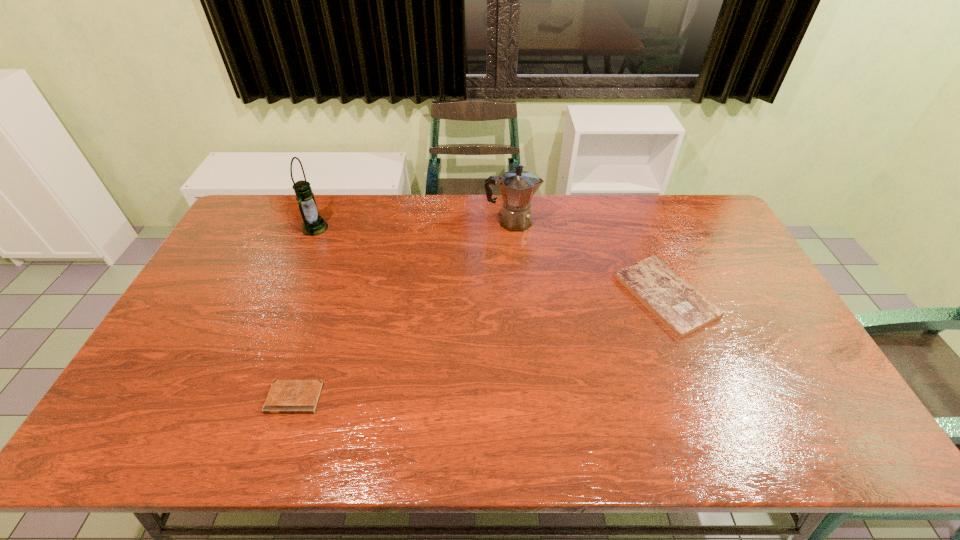
Select which object appears as the third closest to the third object from right to left. Please provide its 2D coordinates. Your answer should be formatted as a tuple, i.e. [(x, y)], where the tuple contains the x and y coordinates of a point satisfying the conditions above.

[(679, 306)]

Find the location of `free space that satisfies the following two spatial constraints: 1. on the pouring side of the coffeepot; 2. on the back side of the rightmost object`. free space that satisfies the following two spatial constraints: 1. on the pouring side of the coffeepot; 2. on the back side of the rightmost object is located at coordinates (517, 295).

At what (x,y) coordinates should I click in order to perform the action: click on vacant space that satisfies the following two spatial constraints: 1. on the side where the leftmost object emits light; 2. on the back side of the Bible. Please return your answer as a coordinate pair (x, y). The height and width of the screenshot is (540, 960). Looking at the image, I should click on (286, 295).

Where is `vacant region that satisfies the following two spatial constraints: 1. on the side where the second shortest object emits light; 2. on the right side of the leftmost object`? vacant region that satisfies the following two spatial constraints: 1. on the side where the second shortest object emits light; 2. on the right side of the leftmost object is located at coordinates (286, 295).

Locate an element on the screen. This screenshot has height=540, width=960. vacant area that satisfies the following two spatial constraints: 1. on the pouring side of the coffeepot; 2. on the spine side of the third object from right to left is located at coordinates (526, 398).

Identify the location of vacant space that satisfies the following two spatial constraints: 1. on the side where the Bible emits light; 2. on the right side of the lantern. The image size is (960, 540). (286, 295).

Where is `free spot that satisfies the following two spatial constraints: 1. on the pouring side of the third farthest object; 2. on the right side of the third object from left to right`? This screenshot has height=540, width=960. free spot that satisfies the following two spatial constraints: 1. on the pouring side of the third farthest object; 2. on the right side of the third object from left to right is located at coordinates (517, 295).

Locate an element on the screen. The width and height of the screenshot is (960, 540). free space in the image that satisfies the following two spatial constraints: 1. on the side where the tallest object emits light; 2. on the left side of the second nearest object is located at coordinates (286, 295).